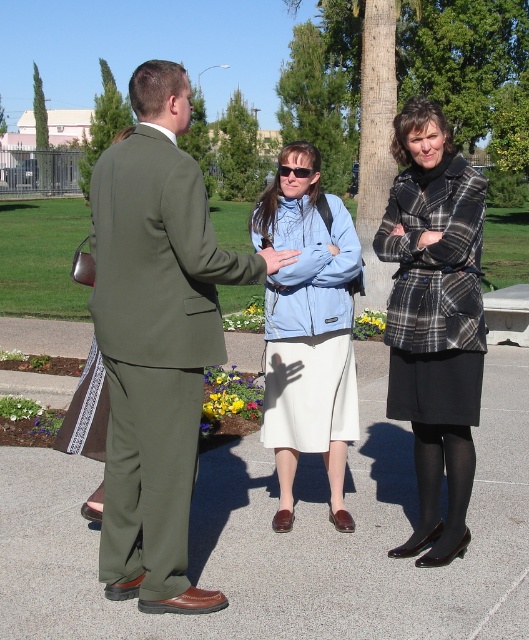
You are a photographer trying to capture a group photo of the two people wearing the olive green suit at center and the light blue fleece jacket at center. Which person should you position closer to the camera to ensure both appear equally sized in the photo?

You should position the olive green suit at center closer to the camera since it occupies less space than the light blue fleece jacket at center, so moving it forward will balance their sizes in the photo.

You are a photographer trying to capture a group photo of the two people in the scene. The camera you are using has a maximum width of 1.2 meters. Can both the olive green suit at center and the light blue fleece jacket at center fit within the camera frame if they stand side by side?

The olive green suit at center might be wider than light blue fleece jacket at center. However, since the exact width of both is not provided, it is uncertain whether they can fit within the 1.2 meters frame. Additional measurements would be needed to confirm.